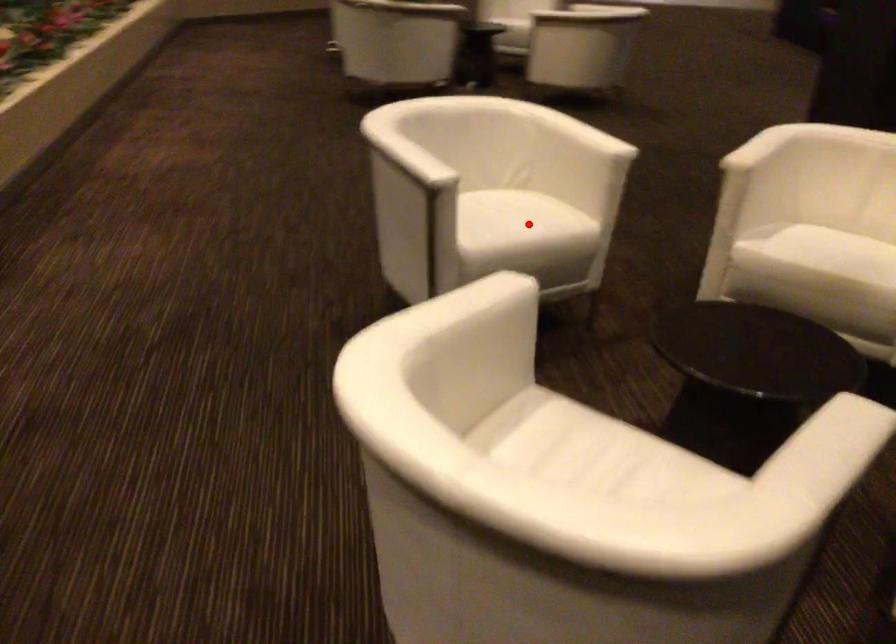
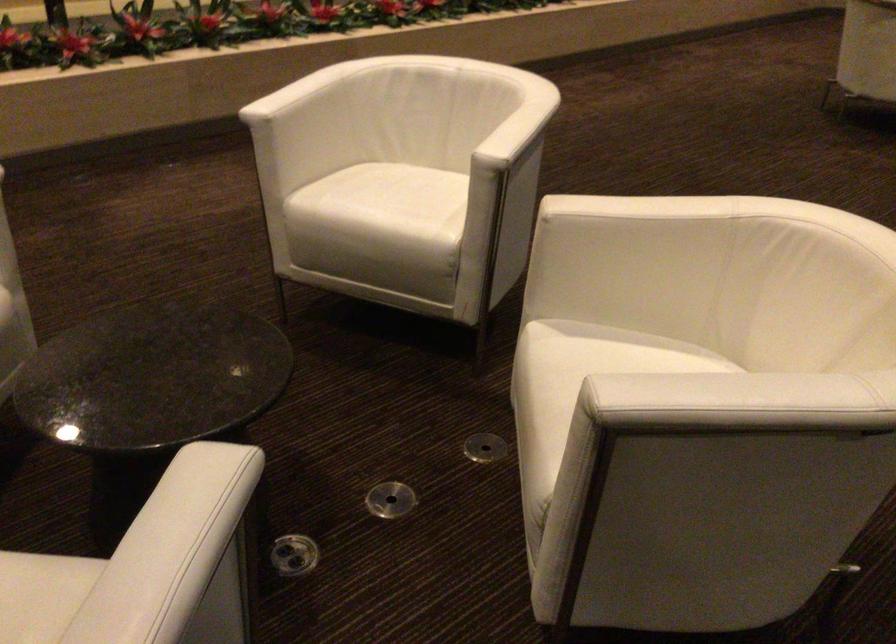
The point at the highlighted location is marked in the first image. Where is the corresponding point in the second image?

(383, 205)